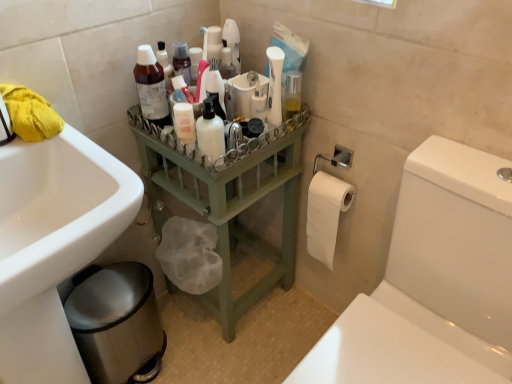
Where is `white matte pump bottle at center, which ranks as the 2th cleaning product in left-to-right order`? Image resolution: width=512 pixels, height=384 pixels. white matte pump bottle at center, which ranks as the 2th cleaning product in left-to-right order is located at coordinates (216, 92).

The width and height of the screenshot is (512, 384). What do you see at coordinates (117, 324) in the screenshot?
I see `metallic silver bidet at lower left` at bounding box center [117, 324].

Identify the location of white matte lotion bottle at center. (210, 133).

Measure the distance between point (x=329, y=219) and camera.

Point (x=329, y=219) is 1.21 meters away from camera.

Describe the element at coordinates (326, 214) in the screenshot. The height and width of the screenshot is (384, 512). I see `white matte toilet paper at right` at that location.

How much space does white glossy bottle at upper center, the first cleaning product from the right, occupy vertically?

The height of white glossy bottle at upper center, the first cleaning product from the right, is 8.11 inches.

The image size is (512, 384). I want to click on white matte pump bottle at center, which ranks as the 2th cleaning product in left-to-right order, so click(216, 92).

Can white glossy bottle at upper center, arranged as the third cleaning product when viewed from the left, be found inside white glossy toilet at right?

No, white glossy bottle at upper center, arranged as the third cleaning product when viewed from the left, is not inside white glossy toilet at right.

From the image's perspective, which one is positioned lower, white glossy toilet at right or white glossy bottle at upper center, the first cleaning product from the right?

white glossy toilet at right.

Is metallic silver bidet at lower left taller or shorter than white matte toilet paper at right?

metallic silver bidet at lower left is shorter than white matte toilet paper at right.

Between metallic silver bidet at lower left and white matte toilet paper at right, which one has smaller width?

Thinner between the two is white matte toilet paper at right.

From a real-world perspective, is metallic silver bidet at lower left physically above white matte toilet paper at right?

Incorrect, from a real-world perspective, metallic silver bidet at lower left is lower than white matte toilet paper at right.

Who is bigger, metallic silver bidet at lower left or white matte toilet paper at right?

metallic silver bidet at lower left is bigger.

Is the depth of metallic silver bidet at lower left greater than that of green painted wood at center?

Yes, it is behind green painted wood at center.

The height and width of the screenshot is (384, 512). I want to click on bidet below the green painted wood at center (from a real-world perspective), so click(117, 324).

Which point is more forward, (x=85, y=350) or (x=284, y=177)?

Point (x=85, y=350)

Is metallic silver bidet at lower left in contact with green painted wood at center?

metallic silver bidet at lower left is not next to green painted wood at center, and they're not touching.

Is point (5, 96) positioned after point (324, 250)?

No.

Is yellow fabric at upper left oriented towards white matte toilet paper at right?

No, yellow fabric at upper left does not turn towards white matte toilet paper at right.

Considering the sizes of yellow fabric at upper left and white matte toilet paper at right in the image, is yellow fabric at upper left bigger or smaller than white matte toilet paper at right?

Considering their sizes, yellow fabric at upper left takes up less space than white matte toilet paper at right.

Is yellow fabric at upper left beside white matte toilet paper at right?

No, yellow fabric at upper left is not making contact with white matte toilet paper at right.

Who is shorter, metallic silver bidet at lower left or translucent plastic bottle at upper center, which is the 3th cleaning product in right-to-left order?

With less height is translucent plastic bottle at upper center, which is the 3th cleaning product in right-to-left order.

Which of these two, metallic silver bidet at lower left or translucent plastic bottle at upper center, which is the 3th cleaning product in right-to-left order, is smaller?

translucent plastic bottle at upper center, which is the 3th cleaning product in right-to-left order.

Based on the photo, would you consider metallic silver bidet at lower left to be distant from translucent plastic bottle at upper center, which is the 3th cleaning product in right-to-left order?

No, metallic silver bidet at lower left is not far away from translucent plastic bottle at upper center, which is the 3th cleaning product in right-to-left order.

From the image's perspective, between metallic silver bidet at lower left and translucent plastic bottle at upper center, which is the 3th cleaning product in right-to-left order, who is located below?

metallic silver bidet at lower left.

From the image's perspective, is translucent plastic bottle at upper center, arranged as the 1th cleaning product when viewed from the left, under metallic silver bidet at lower left?

No.

Is translucent plastic bottle at upper center, arranged as the 1th cleaning product when viewed from the left, bigger or smaller than metallic silver bidet at lower left?

Considering their sizes, translucent plastic bottle at upper center, arranged as the 1th cleaning product when viewed from the left, takes up less space than metallic silver bidet at lower left.

Considering the points (155, 77) and (112, 348), which point is in front, point (155, 77) or point (112, 348)?

The point (155, 77) is closer to the camera.

Is translucent plastic bottle at upper center, arranged as the 1th cleaning product when viewed from the left, facing towards metallic silver bidet at lower left?

No, translucent plastic bottle at upper center, arranged as the 1th cleaning product when viewed from the left, does not turn towards metallic silver bidet at lower left.

From the image's perspective, is white matte pump bottle at center, which appears as the 2th cleaning product when viewed from the right, beneath translucent plastic bottle at upper center, which is the 3th cleaning product in right-to-left order?

Yes.

Is white matte pump bottle at center, which appears as the 2th cleaning product when viewed from the right, looking in the opposite direction of translucent plastic bottle at upper center, arranged as the 1th cleaning product when viewed from the left?

No, white matte pump bottle at center, which appears as the 2th cleaning product when viewed from the right, is not facing away from translucent plastic bottle at upper center, arranged as the 1th cleaning product when viewed from the left.

From a real-world perspective, who is located higher, white matte pump bottle at center, which appears as the 2th cleaning product when viewed from the right, or translucent plastic bottle at upper center, which is the 3th cleaning product in right-to-left order?

white matte pump bottle at center, which appears as the 2th cleaning product when viewed from the right, from a real-world perspective.

I want to click on toilet lying on the right of white glossy bottle at upper center, the first cleaning product from the right, so click(433, 282).

In order to click on bidet located below the white matte toilet paper at right (from the image's perspective) in this screenshot , I will do `click(117, 324)`.

Looking at the image, which one is located further to white glossy sink at lower left, yellow fabric at upper left or white matte pump bottle at center, which appears as the 2th cleaning product when viewed from the right?

white matte pump bottle at center, which appears as the 2th cleaning product when viewed from the right.

Considering their positions, is metallic silver bidet at lower left positioned closer to white matte lotion bottle at center than white glossy sink at lower left?

white glossy sink at lower left is closer to white matte lotion bottle at center.

Estimate the real-world distances between objects in this image. Which object is closer to white matte lotion bottle at center, white glossy sink at lower left or white glossy toilet at right?

white glossy sink at lower left lies closer to white matte lotion bottle at center than the other object.

From the image, which object appears to be nearer to white glossy bottle at upper center, arranged as the third cleaning product when viewed from the left, white glossy toilet at right or green painted wood at center?

green painted wood at center.

From the image, which object appears to be farther from metallic silver bidet at lower left, green painted wood at center or white matte toilet paper at right?

Among the two, white matte toilet paper at right is located further to metallic silver bidet at lower left.

When comparing their distances from white glossy sink at lower left, does green painted wood at center or metallic silver bidet at lower left seem further?

green painted wood at center.

Looking at the image, which one is located further to white glossy toilet at right, translucent plastic bottle at upper center, which is the 3th cleaning product in right-to-left order, or yellow fabric at upper left?

yellow fabric at upper left lies further to white glossy toilet at right than the other object.

Consider the image. Considering their positions, is metallic silver bidet at lower left positioned closer to translucent plastic bottle at upper center, which is the 3th cleaning product in right-to-left order, than white matte lotion bottle at center?

white matte lotion bottle at center is positioned closer to the anchor translucent plastic bottle at upper center, which is the 3th cleaning product in right-to-left order.

Identify the location of balustrade situated between translucent plastic bottle at upper center, arranged as the 1th cleaning product when viewed from the left, and white matte toilet paper at right from left to right. (228, 200).

The width and height of the screenshot is (512, 384). Identify the location of balustrade between white glossy sink at lower left and white matte toilet paper at right. (228, 200).

What are the coordinates of `balustrade positioned between white glossy toilet at right and white matte pump bottle at center, which appears as the 2th cleaning product when viewed from the right, from near to far` in the screenshot? It's located at 228,200.

Locate an element on the screen. toiletry located between translucent plastic bottle at upper center, arranged as the 1th cleaning product when viewed from the left, and white matte toilet paper at right in the left-right direction is located at coordinates (210, 133).